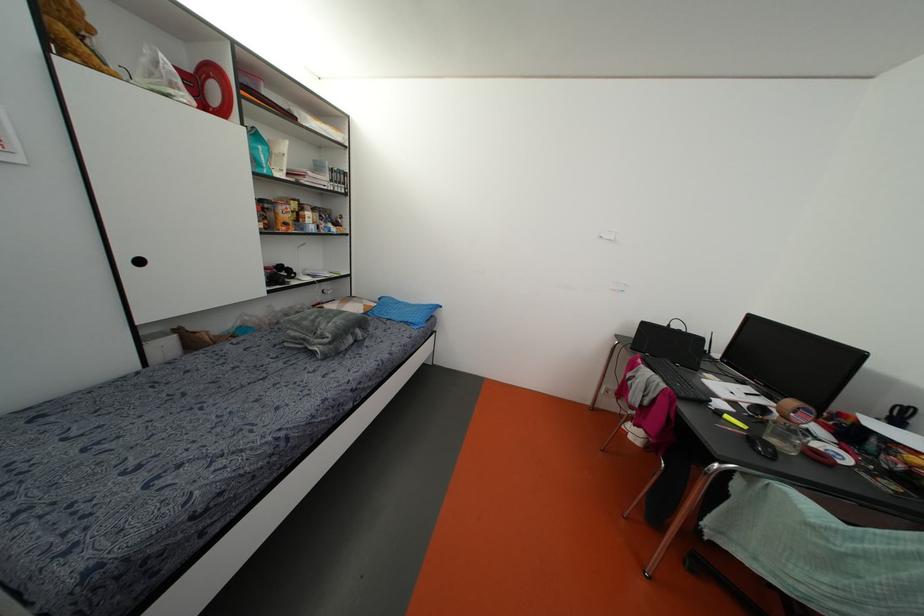
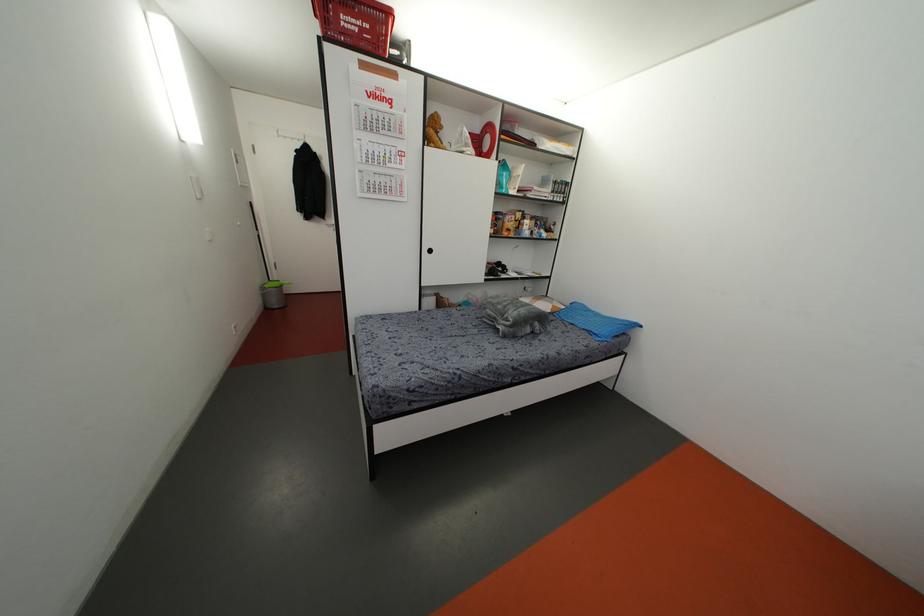
Find the pixel in the second image that matches point 264,171 in the first image.

(503, 191)